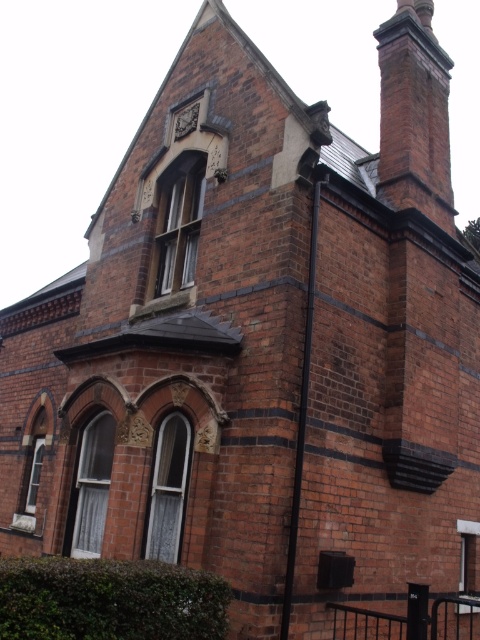
Question: Is brick chimney at upper right further to the viewer compared to dark brown stone clock at upper center?

Choices:
 (A) no
 (B) yes

Answer: (A)

Question: Which point appears closest to the camera in this image?

Choices:
 (A) pyautogui.click(x=405, y=112)
 (B) pyautogui.click(x=194, y=125)

Answer: (A)

Question: Which object appears closest to the camera in this image?

Choices:
 (A) brick chimney at upper right
 (B) dark brown stone clock at upper center

Answer: (A)

Question: Is brick chimney at upper right closer to camera compared to dark brown stone clock at upper center?

Choices:
 (A) no
 (B) yes

Answer: (B)

Question: Can you confirm if brick chimney at upper right is positioned above dark brown stone clock at upper center?

Choices:
 (A) yes
 (B) no

Answer: (A)

Question: Among these objects, which one is farthest from the camera?

Choices:
 (A) dark brown stone clock at upper center
 (B) brick chimney at upper right

Answer: (A)